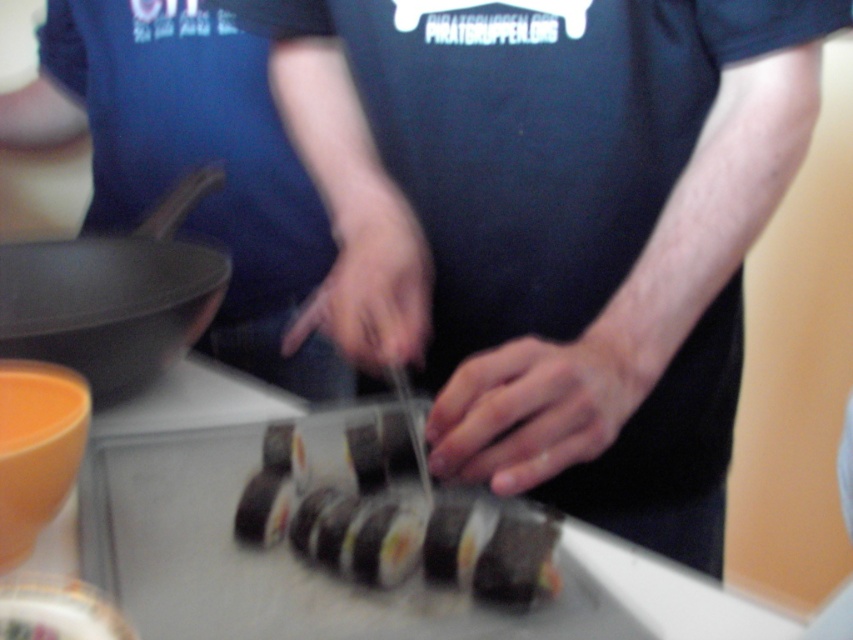
Who is higher up, sushi at center or matte black frying pan at left?

matte black frying pan at left is above.

Is sushi at center smaller than matte black frying pan at left?

Indeed, sushi at center has a smaller size compared to matte black frying pan at left.

In order to click on sushi at center in this screenshot , I will do `click(393, 522)`.

Where is `sushi at center`? This screenshot has width=853, height=640. sushi at center is located at coordinates (393, 522).

Which is above, black matte sushi at center or matte black frying pan at left?

black matte sushi at center is above.

Does point (572, 355) lie in front of point (70, 284)?

That is True.

Where is `black matte sushi at center`? This screenshot has width=853, height=640. black matte sushi at center is located at coordinates (555, 227).

Is black matte sushi at center bigger than sushi at center?

Indeed, black matte sushi at center has a larger size compared to sushi at center.

Does black matte sushi at center have a greater width compared to sushi at center?

Yes.

Describe the element at coordinates (555, 227) in the screenshot. This screenshot has width=853, height=640. I see `black matte sushi at center` at that location.

The image size is (853, 640). Find the location of `black matte sushi at center`. black matte sushi at center is located at coordinates (555, 227).